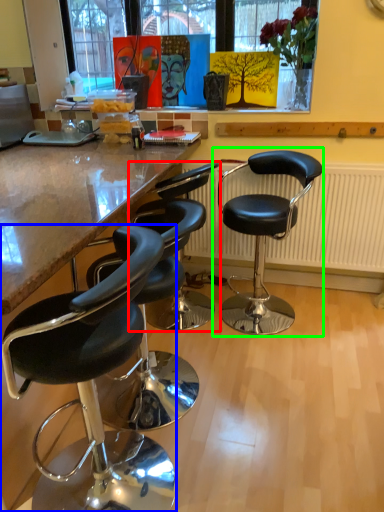
Question: Considering the real-world distances, which object is farthest from chair (highlighted by a red box)? chair (highlighted by a blue box) or chair (highlighted by a green box)?

Choices:
 (A) chair
 (B) chair

Answer: (A)